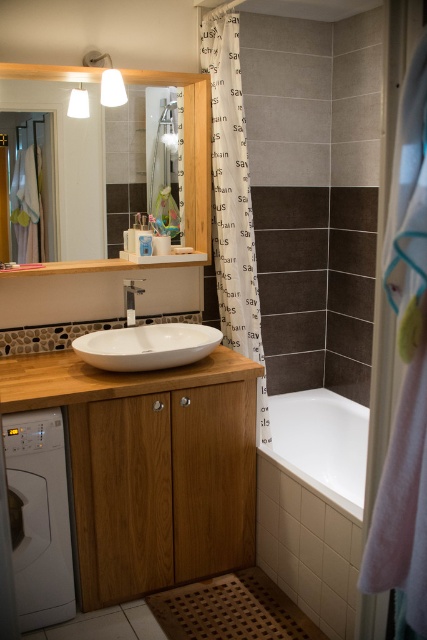
You are a guest in this bathroom and need to dry your hands. You see the pink fabric towel at right and the white glossy sink at center. Which object should you use to dry your hands?

The pink fabric towel at right is positioned on the right side of the white glossy sink at center, so you should use the pink fabric towel at right to dry your hands.

You are standing in the bathroom and need to reach both points. Which point, point (216, 563) or point (290, 432), is closer to you?

Point (216, 563) is closer to the viewer than point (290, 432).

You are designing a bathroom layout and need to place a tall plant that requires a surface at least 1.2 meters in height. Given the white wood vanity at center and the white glossy bathtub at lower right, which object can support the plant?

The white wood vanity at center is much taller than the white glossy bathtub at lower right, so the plant can be placed on the white wood vanity at center since it meets the height requirement.